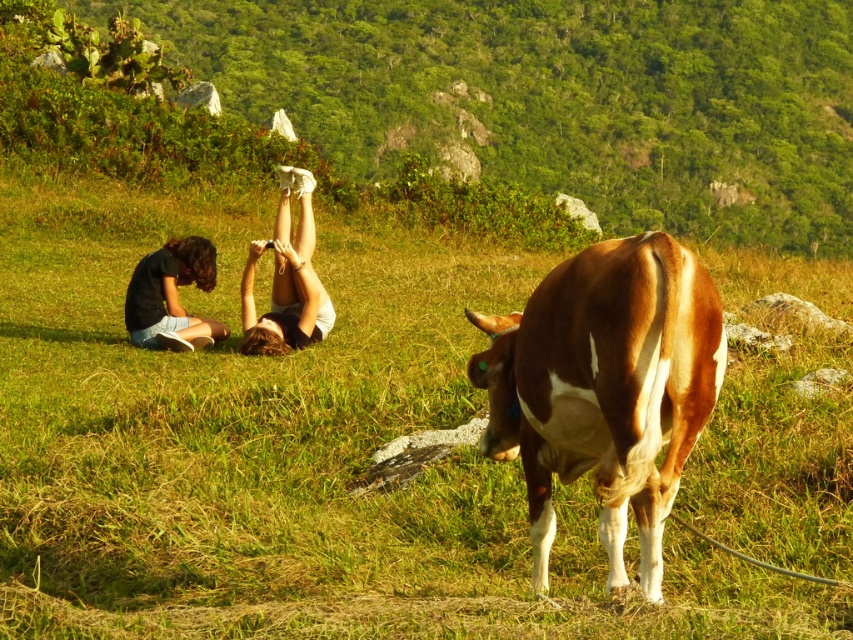
Is point (248, 323) closer to viewer compared to point (144, 314)?

Yes, it is in front of point (144, 314).

Between matte black shorts at lower left and matte black shirt at lower left, which one has less height?

matte black shirt at lower left is shorter.

The height and width of the screenshot is (640, 853). Describe the element at coordinates (171, 296) in the screenshot. I see `matte black shorts at lower left` at that location.

Locate an element on the screen. matte black shorts at lower left is located at coordinates (171, 296).

Does green leafy hillside at upper center appear under matte black shorts at lower left?

Incorrect, green leafy hillside at upper center is not positioned below matte black shorts at lower left.

Can you confirm if green leafy hillside at upper center is shorter than matte black shorts at lower left?

In fact, green leafy hillside at upper center may be taller than matte black shorts at lower left.

You are a GUI agent. You are given a task and a screenshot of the screen. Output one action in this format:
    pyautogui.click(x=<x>, y=<y>)
    Task: Click on the green leafy hillside at upper center
    
    Given the screenshot: What is the action you would take?
    pyautogui.click(x=556, y=97)

Is brown and white cow at center bigger than matte black shorts at lower left?

No.

Which is behind, point (675, 284) or point (178, 321)?

The point (178, 321) is behind.

Find the location of a particular element. The height and width of the screenshot is (640, 853). brown and white cow at center is located at coordinates (605, 387).